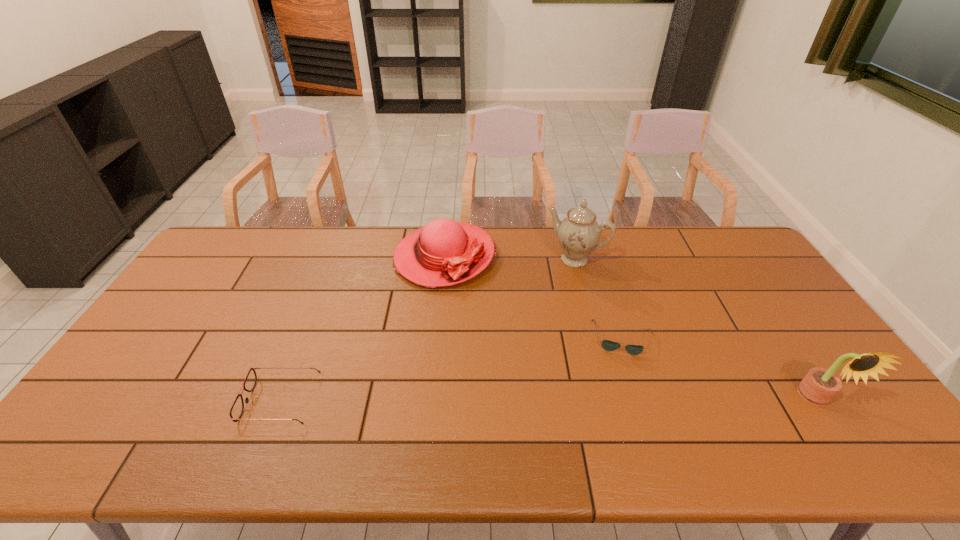
Locate an element on the screen. This screenshot has width=960, height=540. blank space located 0.140m on the front-facing side of the left sunglasses is located at coordinates (192, 401).

Locate an element on the screen. The width and height of the screenshot is (960, 540). vacant area situated 0.290m on the spout of the chinaware is located at coordinates (526, 326).

Find the location of a particular element. free space located on the spout of the chinaware is located at coordinates (510, 351).

Identify the location of vacant region located 0.290m on the spout of the chinaware. (526, 326).

The image size is (960, 540). What are the coordinates of `free point located 0.400m at the front of the third tallest object with a bow` in the screenshot? It's located at (471, 396).

I want to click on vacant region located at the front of the third tallest object with a bow, so click(x=455, y=306).

Where is `vacant area situated 0.200m at the front of the third tallest object with a bow`? This screenshot has width=960, height=540. vacant area situated 0.200m at the front of the third tallest object with a bow is located at coordinates (461, 338).

The width and height of the screenshot is (960, 540). I want to click on vacant space located 0.100m on the lenses of the farther sunglasses, so click(623, 386).

Locate an element on the screen. vacant area situated on the lenses of the farther sunglasses is located at coordinates (623, 392).

What are the coordinates of `chinaware that is at the far edge` in the screenshot? It's located at (578, 234).